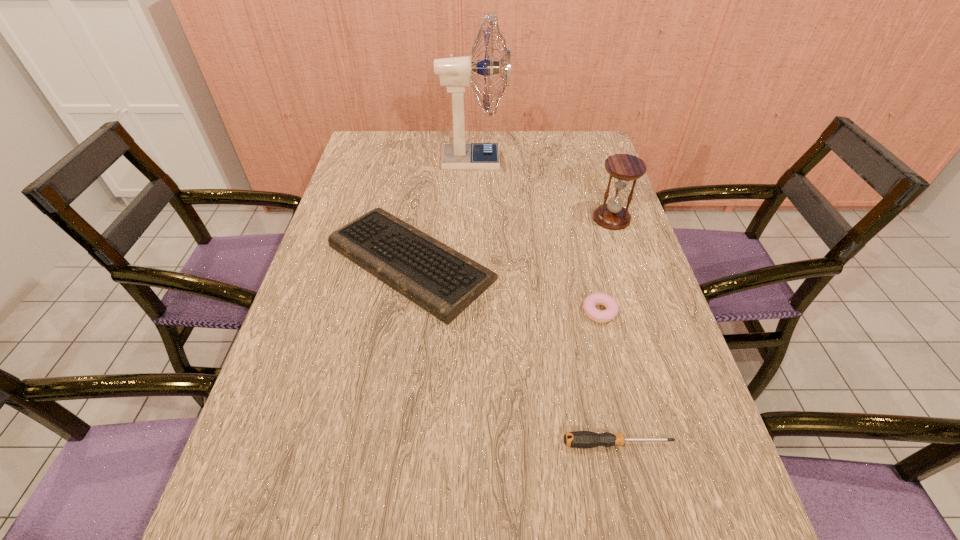
Locate an element on the screen. The image size is (960, 540). free point that satisfies the following two spatial constraints: 1. on the back side of the computer keyboard; 2. on the right side of the fourth shortest object is located at coordinates (418, 219).

I want to click on free spot that satisfies the following two spatial constraints: 1. on the front-facing side of the fan; 2. on the back side of the screwdriver, so click(468, 443).

The height and width of the screenshot is (540, 960). Identify the location of free space that satisfies the following two spatial constraints: 1. on the back side of the computer keyboard; 2. on the left side of the hourglass. tap(418, 219).